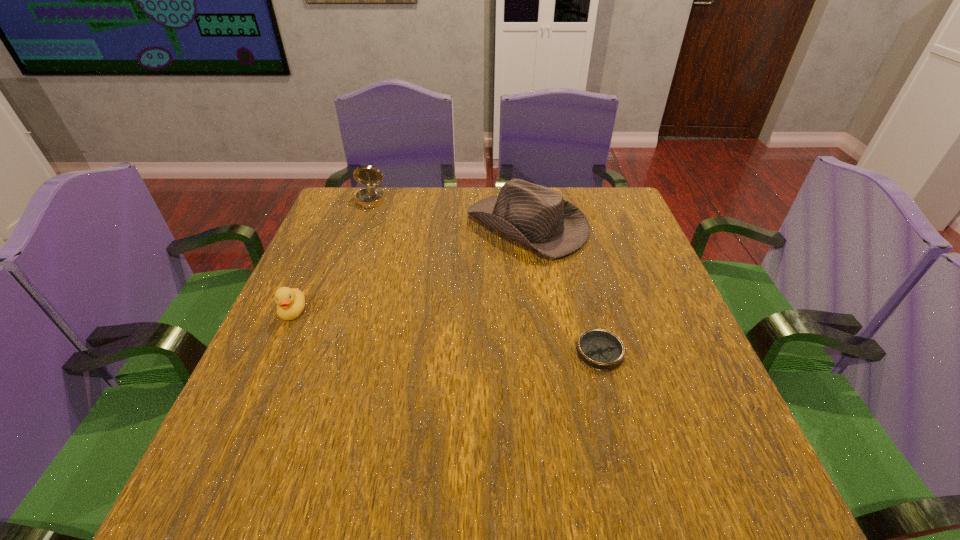
Locate an element on the screen. The height and width of the screenshot is (540, 960). fedora is located at coordinates (538, 218).

Locate an element on the screen. This screenshot has height=540, width=960. the left compass is located at coordinates (370, 197).

The image size is (960, 540). I want to click on the taller compass, so (x=370, y=197).

In order to click on the second nearest object in this screenshot , I will do `click(290, 302)`.

Where is `the second shortest object`? The image size is (960, 540). the second shortest object is located at coordinates (290, 302).

Locate an element on the screen. Image resolution: width=960 pixels, height=540 pixels. the shorter compass is located at coordinates (599, 349).

This screenshot has height=540, width=960. In order to click on the nearer compass in this screenshot , I will do `click(599, 349)`.

Find the location of a particular element. vacant area located on the left of the fedora is located at coordinates (424, 226).

The image size is (960, 540). I want to click on vacant area situated 0.180m with the dial facing the farther compass, so click(353, 249).

Find the location of a particular element. free region located 0.180m on the face of the duckling is located at coordinates [255, 396].